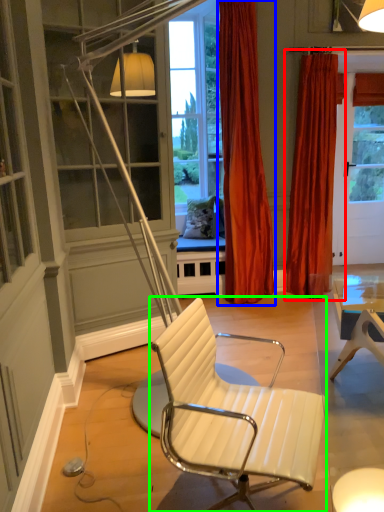
Question: Estimate the real-world distances between objects in this image. Which object is farther from curtain (highlighted by a red box), curtain (highlighted by a blue box) or chair (highlighted by a green box)?

Choices:
 (A) curtain
 (B) chair

Answer: (B)